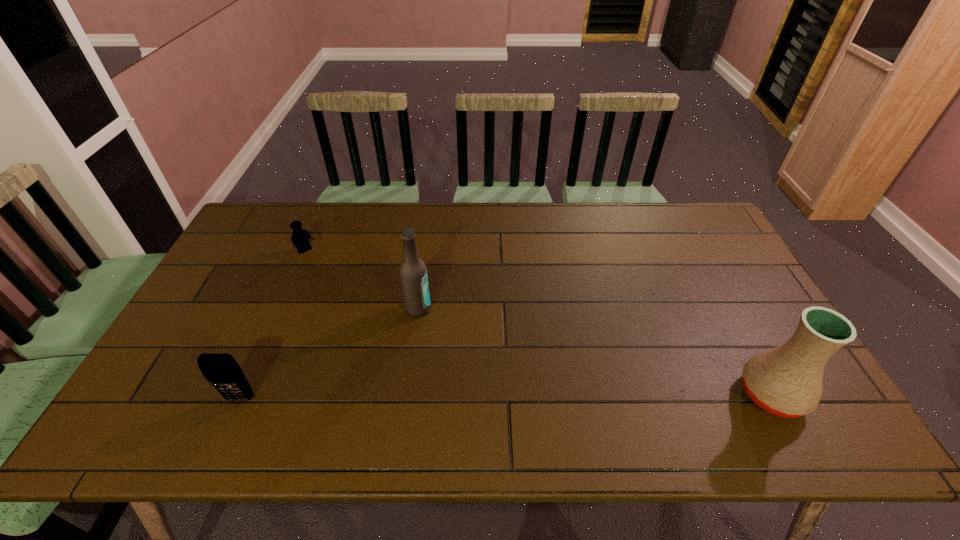
Where is `vacant spot on the desktop that is between the cellular telephone and the pottery and is positioned on the front-facing side of the Lego`? The image size is (960, 540). vacant spot on the desktop that is between the cellular telephone and the pottery and is positioned on the front-facing side of the Lego is located at coordinates [x=444, y=397].

Locate an element on the screen. vacant spot on the desktop that is between the third tallest object and the rightmost object and is positioned on the side of the third object from left to right with the label is located at coordinates (539, 396).